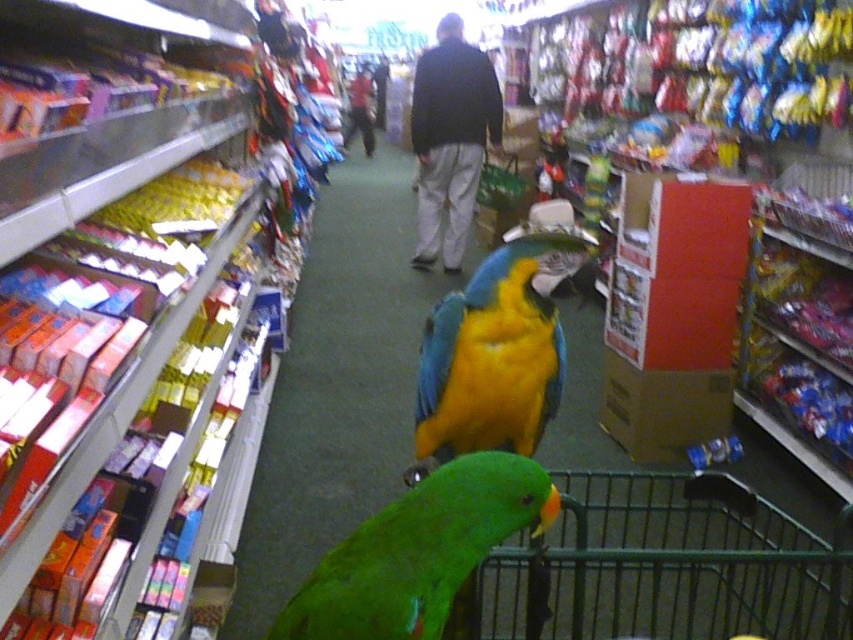
You are standing at the end of the grocery store aisle and see two points marked on the floor. The first point is at coordinate point (323, 561) and the second point is at coordinate point (424, 403). Which point is closer to you?

Point (323, 561) is in front of point (424, 403), so it is closer to you.